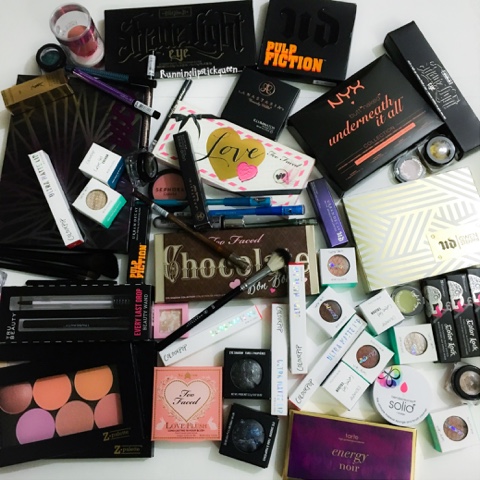
This screenshot has width=480, height=480. I want to click on candles, so click(50, 400).